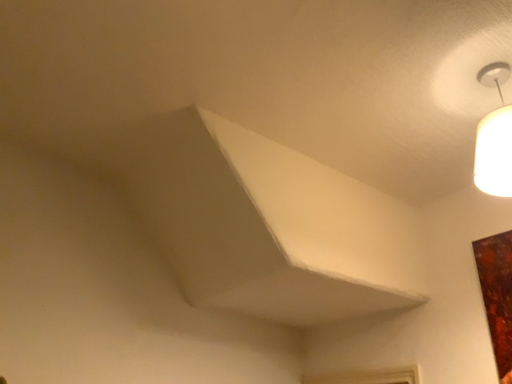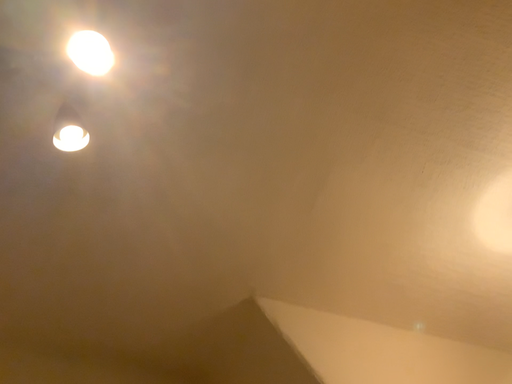
Question: Which way did the camera rotate in the video?

Choices:
 (A) rotated right
 (B) rotated left

Answer: (B)